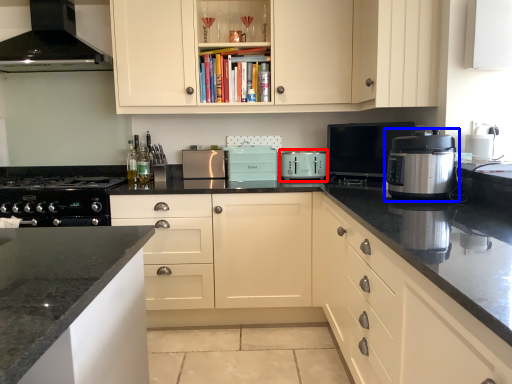
Question: Which point is further to the camera, kitchen appliance (highlighted by a red box) or kitchen appliance (highlighted by a blue box)?

Choices:
 (A) kitchen appliance
 (B) kitchen appliance

Answer: (A)